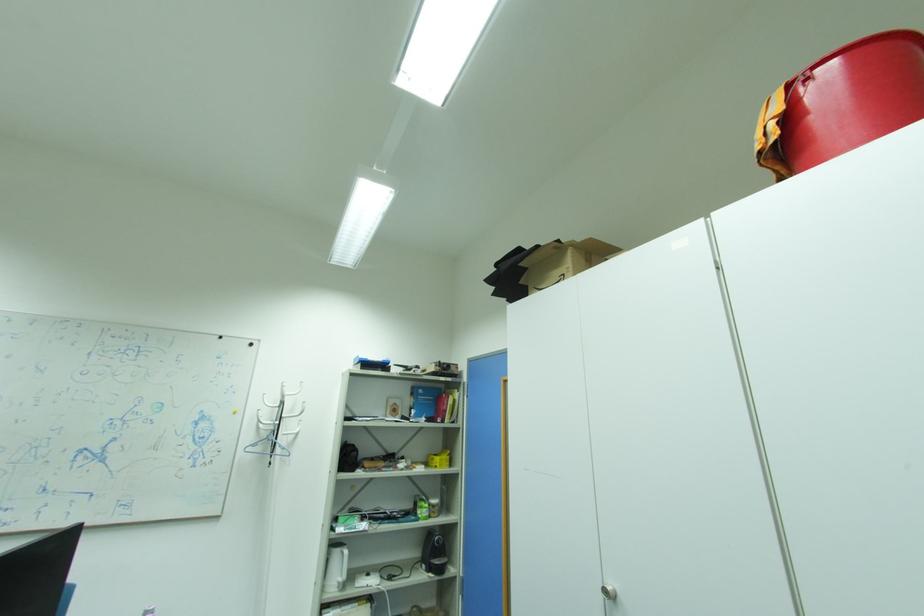
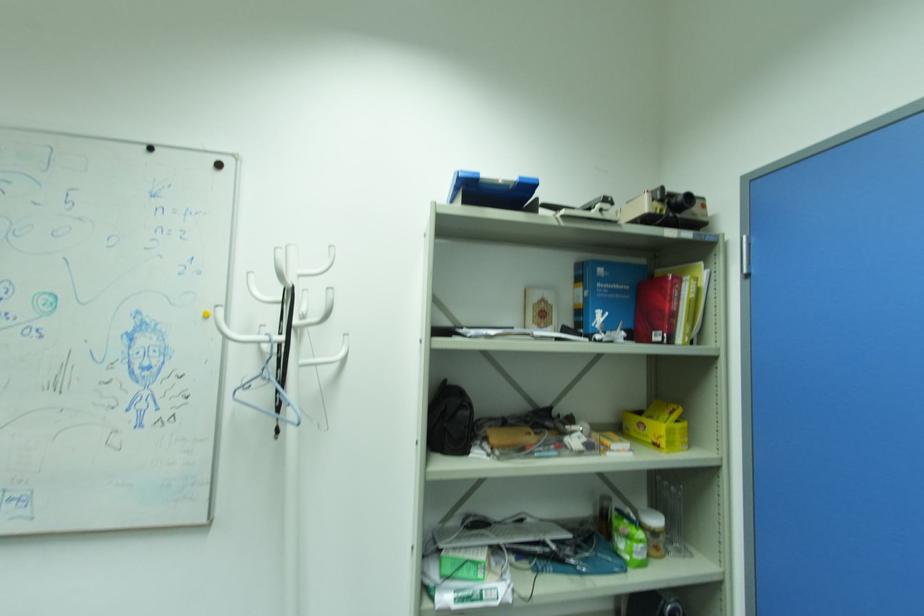
Question: In a continuous first-person perspective shot, in which direction is the camera moving?

Choices:
 (A) Left
 (B) Right
 (C) Forward
 (D) Backward

Answer: (C)